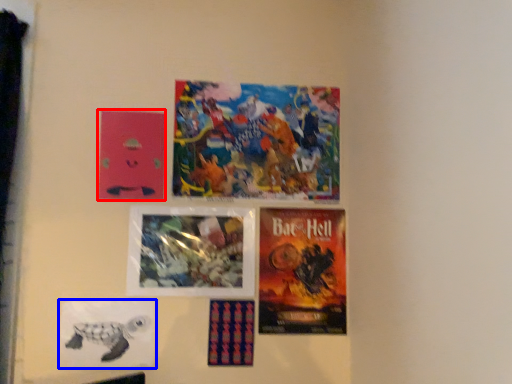
Question: Which of the following is the farthest to the observer, poster (highlighted by a red box) or poster (highlighted by a blue box)?

Choices:
 (A) poster
 (B) poster

Answer: (A)